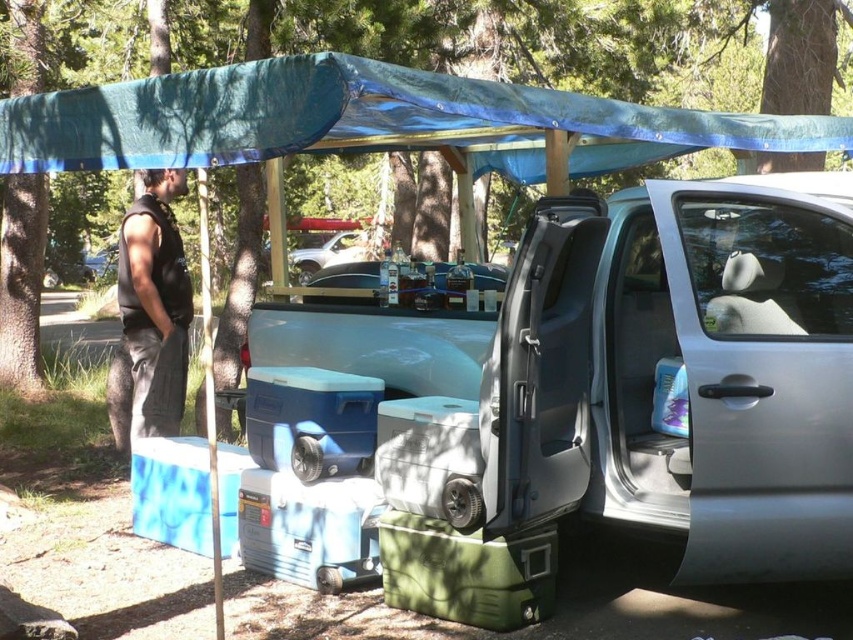
Between black sleeveless shirt at left and metallic silver car at center, which one appears on the right side from the viewer's perspective?

From the viewer's perspective, black sleeveless shirt at left appears more on the right side.

Which is more to the left, black sleeveless shirt at left or metallic silver car at center?

From the viewer's perspective, metallic silver car at center appears more on the left side.

Is point (183, 324) behind point (370, 256)?

No, it is in front of (370, 256).

Locate an element on the screen. The image size is (853, 640). black sleeveless shirt at left is located at coordinates (154, 301).

Does blue tarpaulin at upper center have a larger size compared to metallic silver car at center?

No, blue tarpaulin at upper center is not bigger than metallic silver car at center.

Between point (277, 129) and point (326, 257), which one is positioned in front?

Point (277, 129) is more forward.

Is point (194, 140) farther from viewer compared to point (300, 257)?

No, it is not.

This screenshot has width=853, height=640. What are the coordinates of `blue tarpaulin at upper center` in the screenshot? It's located at (370, 122).

Can you confirm if satin silver minivan at center is thinner than black sleeveless shirt at left?

Incorrect, satin silver minivan at center's width is not less than black sleeveless shirt at left's.

How far apart are satin silver minivan at center and black sleeveless shirt at left?

satin silver minivan at center and black sleeveless shirt at left are 9.46 feet apart.

Measure the distance between satin silver minivan at center and camera.

satin silver minivan at center is 3.49 meters from camera.

Where is `satin silver minivan at center`? The height and width of the screenshot is (640, 853). satin silver minivan at center is located at coordinates (728, 372).